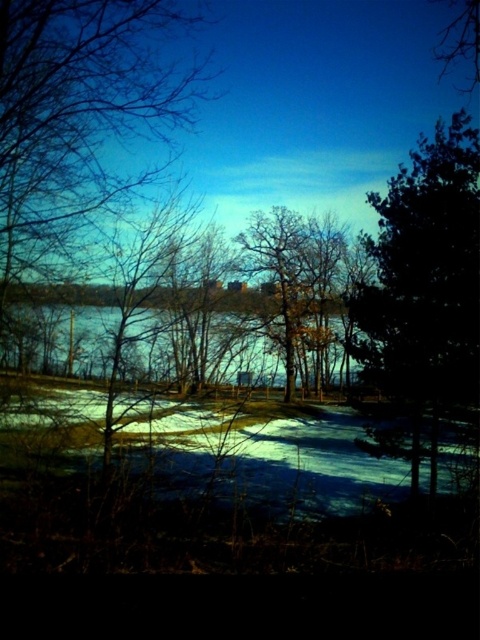
Question: Which of these objects is positioned farthest from the green leafy tree at right?

Choices:
 (A) blue water at center
 (B) frozen water at center

Answer: (A)

Question: Among these points, which one is nearest to the camera?

Choices:
 (A) (96, 323)
 (B) (392, 346)

Answer: (A)

Question: Observing the image, what is the correct spatial positioning of green leafy tree at right in reference to frozen water at center?

Choices:
 (A) below
 (B) above

Answer: (B)

Question: Among these points, which one is farthest from the camera?

Choices:
 (A) (439, 324)
 (B) (322, 426)

Answer: (A)

Question: Does green leafy tree at right lie behind blue water at center?

Choices:
 (A) no
 (B) yes

Answer: (B)

Question: Can you confirm if green leafy tree at right is thinner than blue water at center?

Choices:
 (A) no
 (B) yes

Answer: (A)